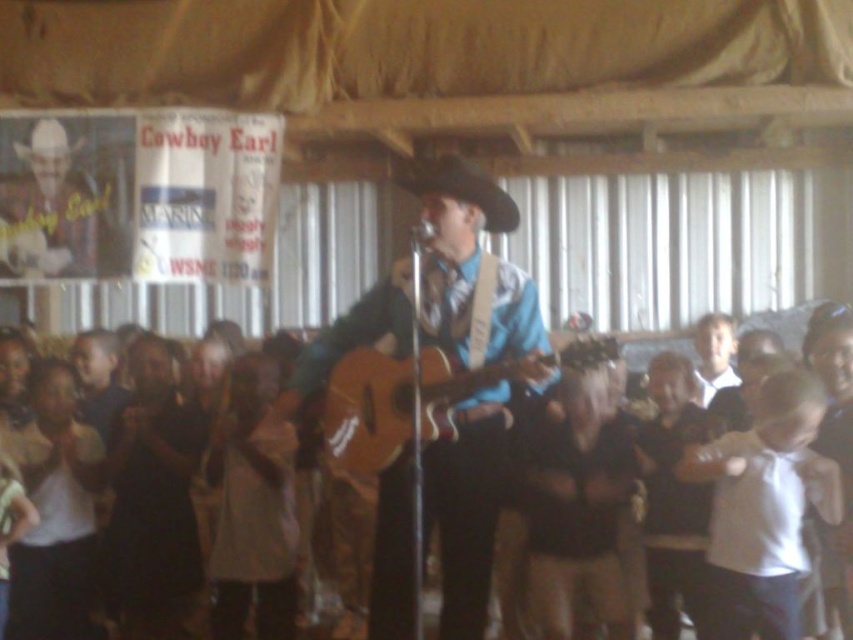
Looking at this image, you are a stagehand preparing to place a 1.2 meter wide equipment box on the stage. The box needs to fit between the light brown fabric at lower center and the wooden guitar at center. Can the box fit based on their widths?

The light brown fabric at lower center is wider than the wooden guitar at center. However, the combined width of both objects would need to be subtracted from the total available space to determine if the 1.2 meter box can fit. Since the exact widths aren

In the scene, you see a light brown fabric shirt at lower left and an acoustic wood guitar at center. Which object is taller?

The light brown fabric shirt at lower left is much taller as acoustic wood guitar at center.

You are a stagehand setting up for a performance. You need to place a new microphone stand between the light brown fabric at lower center and the acoustic wood guitar at center. Considering their sizes, which object should you position closer to the center of the stage to ensure the microphone stand fits properly?

The light brown fabric at lower center is smaller than the acoustic wood guitar at center, so positioning the microphone stand closer to the acoustic wood guitar at center will provide more space between the smaller fabric and the stand, ensuring proper placement.